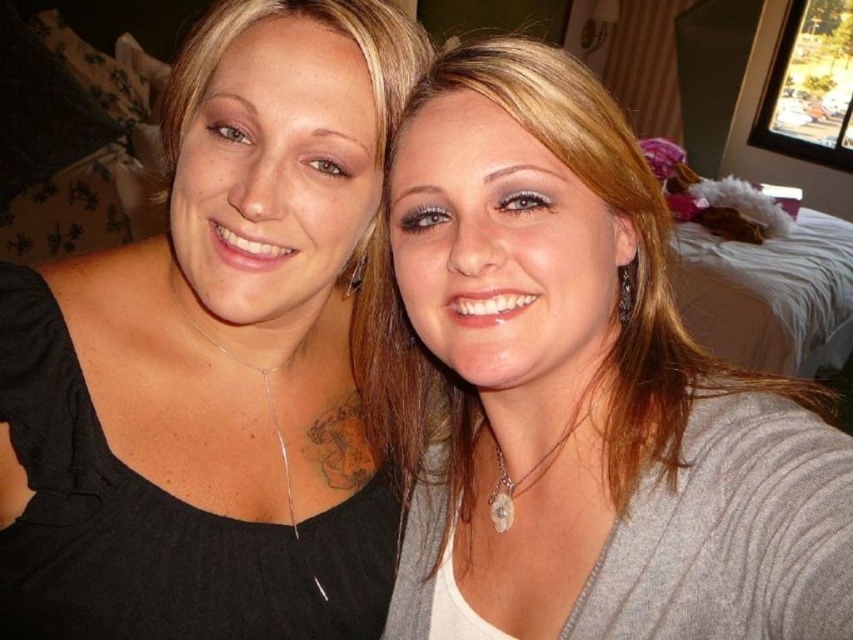
You are trying to decide which clothing item to choose for an event. You have the black matte shirt at left and the matte gray sweater at center. Based on their sizes, which one might be more suitable if you want something that covers your arms more?

The matte gray sweater at center has a greater width than the black matte shirt at left, making it more suitable for covering your arms more.

You are a photographer trying to adjust the lighting for a photo shoot. The black matte shirt at left is represented by point (218, 358). Where should you place a spotlight to ensure the black matte shirt at left is well lit?

The black matte shirt at left is represented by point (218, 358), so place the spotlight near that coordinate to ensure proper lighting.